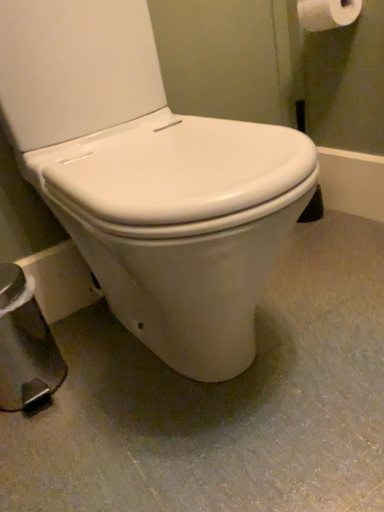
At what (x,y) coordinates should I click in order to perform the action: click on empty space that is ontop of white smooth toilet at center (from a real-world perspective). Please return your answer as a coordinate pair (x, y). Looking at the image, I should click on (223, 387).